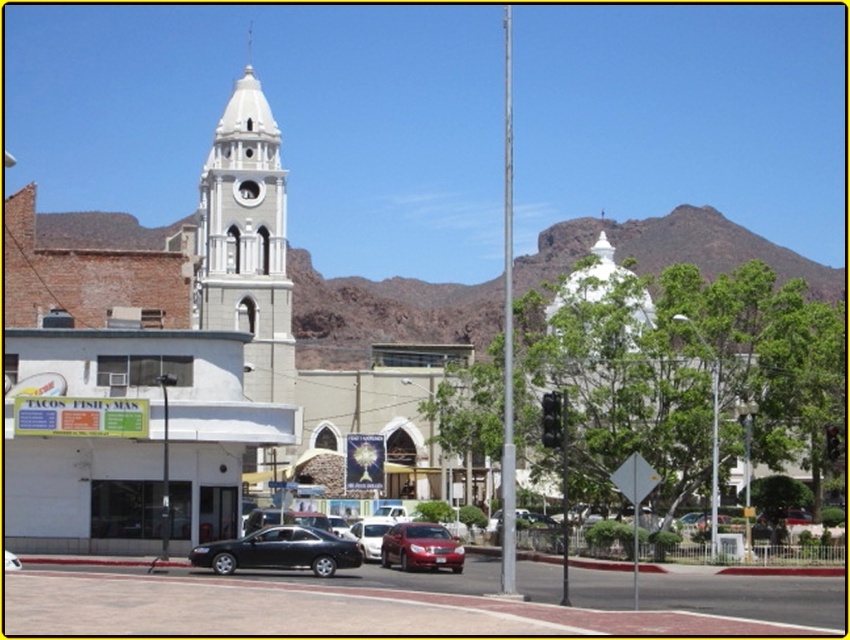
Question: Does white stone clock tower at upper left appear on the right side of shiny red sedan at center?

Choices:
 (A) no
 (B) yes

Answer: (A)

Question: Which point is farther to the camera?

Choices:
 (A) matte black sedan at center
 (B) metallic silver sedan at center

Answer: (B)

Question: Which point is farther to the camera?

Choices:
 (A) white stone clock tower at upper left
 (B) metallic silver sedan at center
 (C) matte black sedan at center
 (D) shiny red sedan at center

Answer: (A)

Question: Based on their relative distances, which object is farther from the metallic silver sedan at center?

Choices:
 (A) white stone clock tower at upper left
 (B) matte black sedan at center
 (C) shiny red sedan at center

Answer: (A)

Question: Is matte black sedan at center behind metallic silver sedan at center?

Choices:
 (A) no
 (B) yes

Answer: (A)

Question: Is matte black sedan at center closer to the viewer compared to shiny red sedan at center?

Choices:
 (A) yes
 (B) no

Answer: (A)